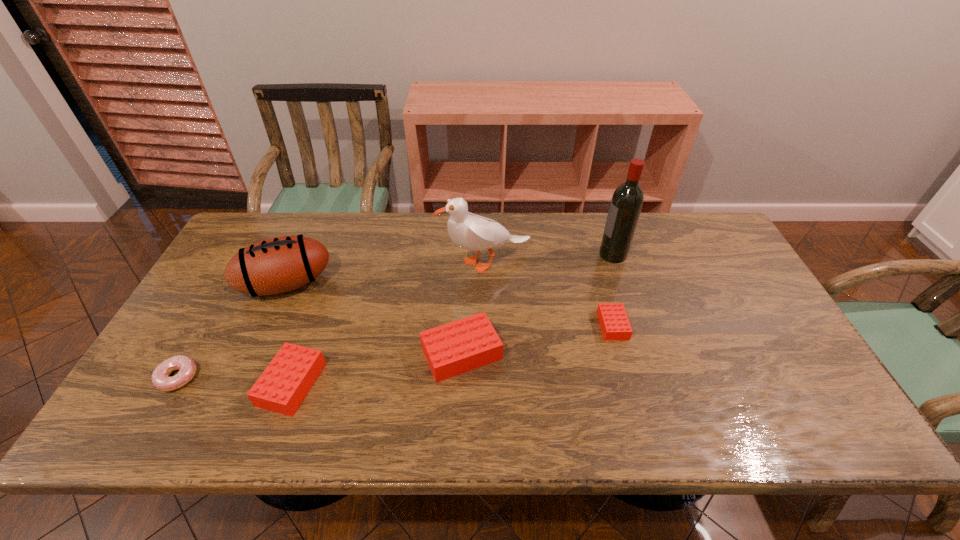
Locate an element on the screen. This screenshot has height=540, width=960. unoccupied area between the wine bottle and the doughnut is located at coordinates (396, 316).

Locate an element on the screen. free space that is in between the gull and the second shortest Lego is located at coordinates (389, 323).

Image resolution: width=960 pixels, height=540 pixels. I want to click on free space between the doughnut and the third tallest object, so click(232, 331).

At what (x,y) coordinates should I click in order to perform the action: click on empty location between the wine bottle and the football (American). Please return your answer as a coordinate pair (x, y). The image size is (960, 540). Looking at the image, I should click on (449, 269).

This screenshot has height=540, width=960. I want to click on free space between the second Lego from left to right and the shortest Lego, so click(537, 339).

The width and height of the screenshot is (960, 540). I want to click on free area in between the gull and the second Lego from right to left, so (473, 308).

Select which object appears as the closest to the doughnut. Please provide its 2D coordinates. Your answer should be formatted as a tuple, i.e. [(x, y)], where the tuple contains the x and y coordinates of a point satisfying the conditions above.

[(281, 388)]

At what (x,y) coordinates should I click in order to perform the action: click on object that is the nearest to the football (American). Please return your answer as a coordinate pair (x, y). Looking at the image, I should click on (281, 388).

Identify which Lego is located as the nearest to the doughnut. Please provide its 2D coordinates. Your answer should be formatted as a tuple, i.e. [(x, y)], where the tuple contains the x and y coordinates of a point satisfying the conditions above.

[(281, 388)]

Choose which Lego is the nearest neighbor to the rightmost Lego. Please provide its 2D coordinates. Your answer should be formatted as a tuple, i.e. [(x, y)], where the tuple contains the x and y coordinates of a point satisfying the conditions above.

[(457, 347)]